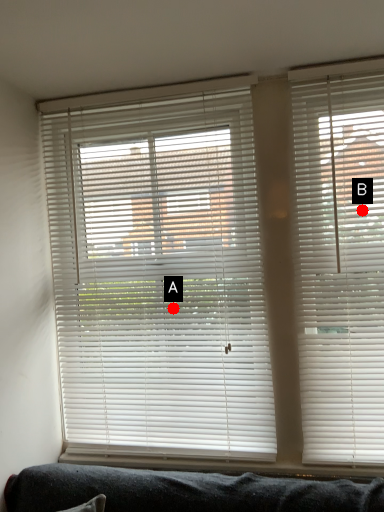
Question: Two points are circled on the image, labeled by A and B beside each circle. Which point is closer to the camera?

Choices:
 (A) A is closer
 (B) B is closer

Answer: (B)